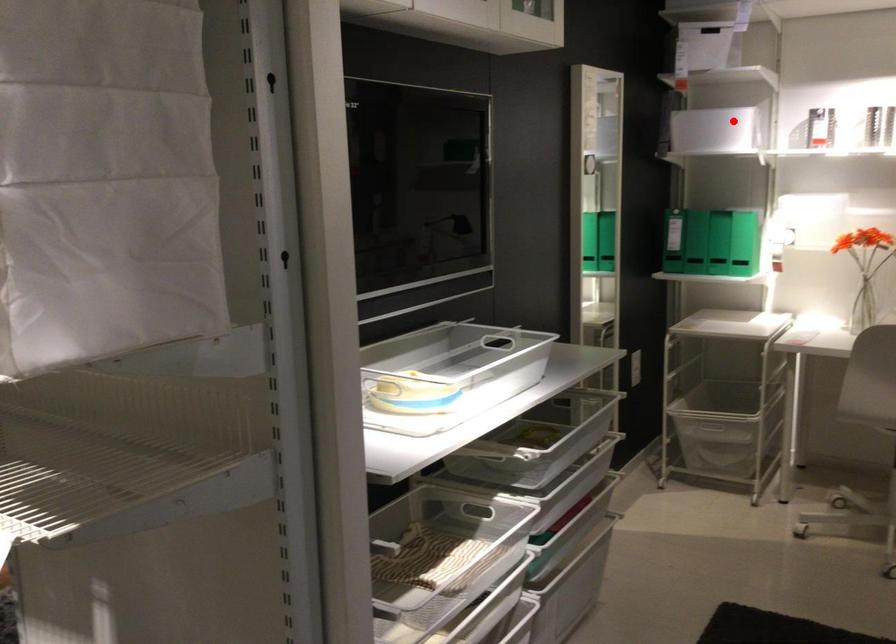
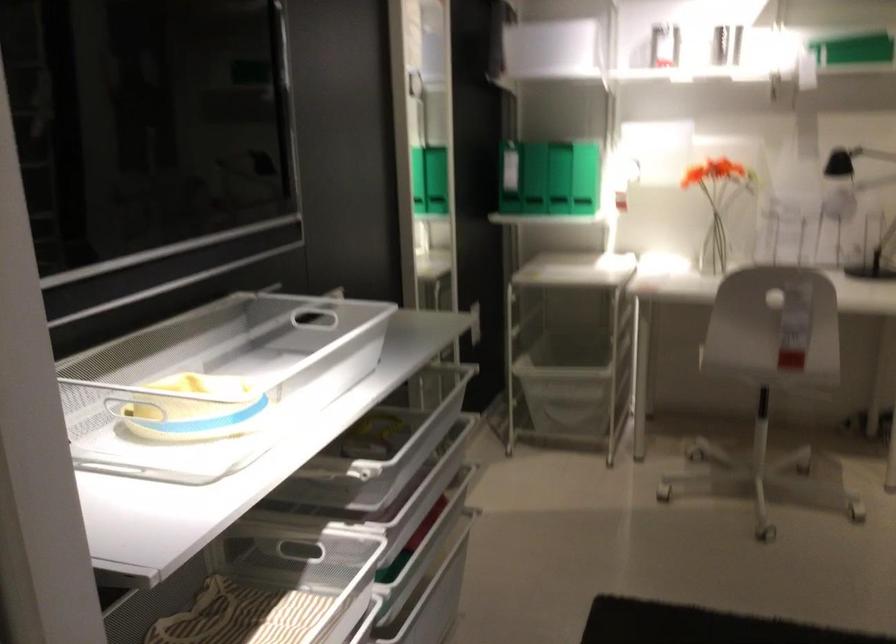
In the second image, find the point that corresponds to the highlighted location in the first image.

(556, 46)